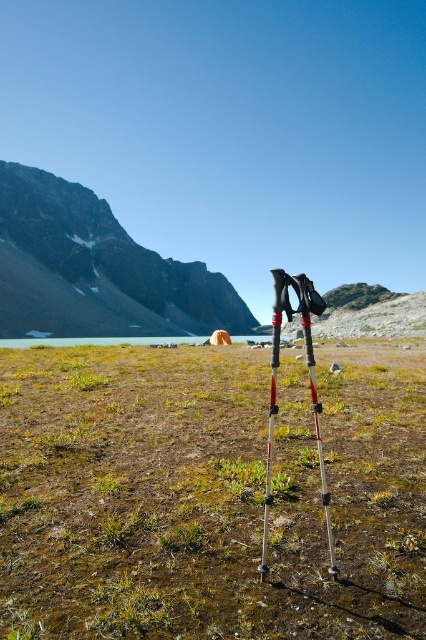
Is green grass at center bigger than polished aluminum ski pole at center?

Yes, green grass at center is bigger than polished aluminum ski pole at center.

Between green grass at center and polished aluminum ski pole at center, which one has less height?

With less height is green grass at center.

Locate an element on the screen. The image size is (426, 640). green grass at center is located at coordinates (206, 497).

Who is taller, rugged stone mountain at upper left or polished aluminum ski pole at center?

Standing taller between the two is rugged stone mountain at upper left.

Based on the photo, does rugged stone mountain at upper left have a lesser width compared to polished aluminum ski pole at center?

Incorrect, rugged stone mountain at upper left's width is not less than polished aluminum ski pole at center's.

Does point (14, 214) lie behind point (275, 348)?

Yes.

Identify the location of rugged stone mountain at upper left. The image size is (426, 640). (95, 269).

Can you confirm if green grass at center is positioned above rugged stone mountain at upper left?

No.

Can you confirm if green grass at center is positioned to the left of rugged stone mountain at upper left?

In fact, green grass at center is to the right of rugged stone mountain at upper left.

The height and width of the screenshot is (640, 426). What do you see at coordinates (206, 497) in the screenshot? I see `green grass at center` at bounding box center [206, 497].

At what (x,y) coordinates should I click in order to perform the action: click on green grass at center. Please return your answer as a coordinate pair (x, y). The width and height of the screenshot is (426, 640). Looking at the image, I should click on (206, 497).